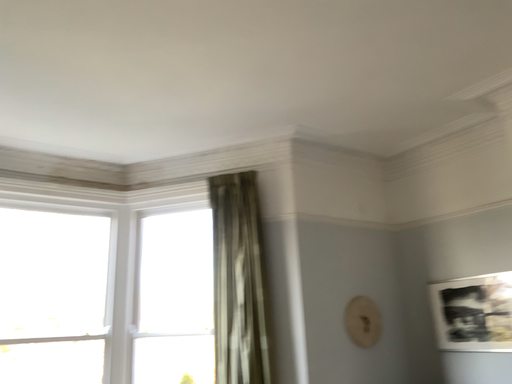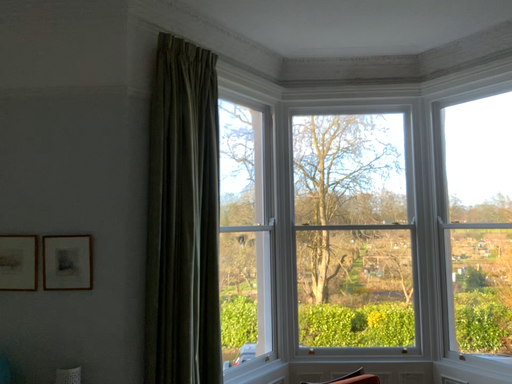
Question: How did the camera likely rotate when shooting the video?

Choices:
 (A) rotated left
 (B) rotated right

Answer: (A)